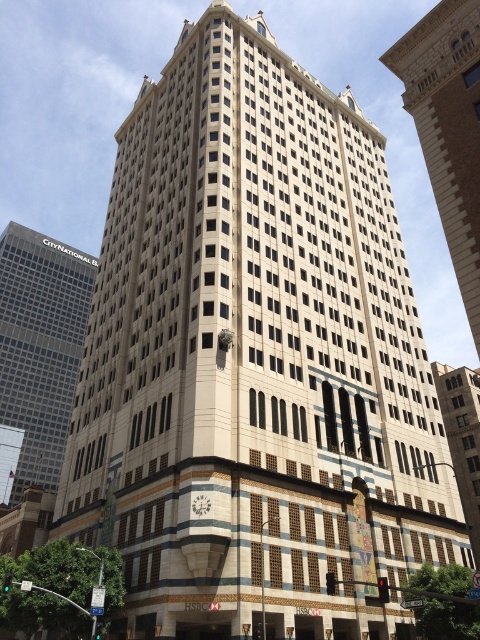
Between gray glass skyscraper at left and beige stone building at center, which one is positioned lower?

gray glass skyscraper at left is lower down.

Who is positioned more to the right, gray glass skyscraper at left or beige stone building at center?

Positioned to the right is beige stone building at center.

Who is more forward, (x=26, y=358) or (x=474, y=22)?

Point (x=474, y=22) is in front.

The width and height of the screenshot is (480, 640). Identify the location of gray glass skyscraper at left. (40, 346).

Is point (392, 51) closer to viewer compared to point (459, 474)?

Yes, point (392, 51) is in front of point (459, 474).

Can you confirm if beige stone building at center is positioned below slate gray stone building at center?

No, beige stone building at center is not below slate gray stone building at center.

Is point (436, 170) closer to viewer compared to point (465, 467)?

That is True.

What are the coordinates of `beige stone building at center` in the screenshot? It's located at (447, 128).

Can you confirm if gray glass skyscraper at left is thinner than slate gray stone building at center?

In fact, gray glass skyscraper at left might be wider than slate gray stone building at center.

Between gray glass skyscraper at left and slate gray stone building at center, which one appears on the left side from the viewer's perspective?

From the viewer's perspective, gray glass skyscraper at left appears more on the left side.

Is point (67, 433) farther from camera compared to point (476, 484)?

Yes, point (67, 433) is farther from viewer.

Where is `gray glass skyscraper at left`? gray glass skyscraper at left is located at coordinates (40, 346).